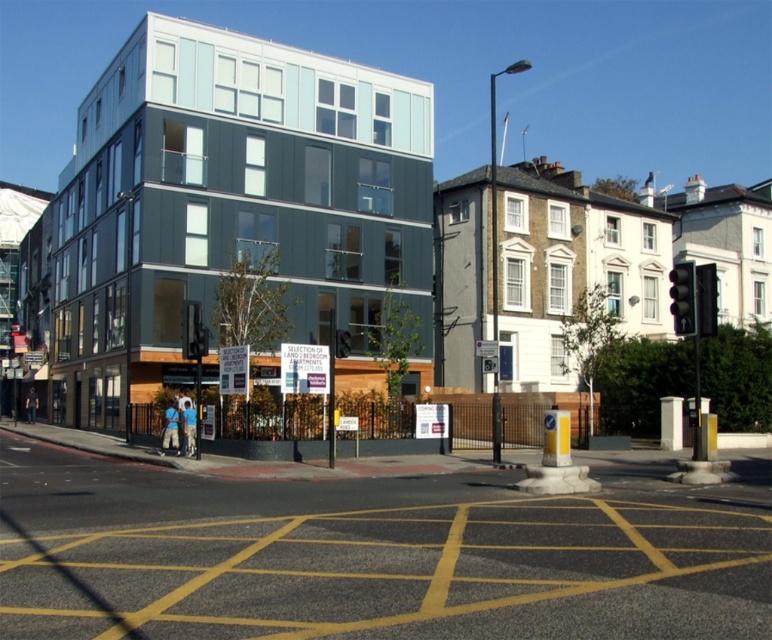
You are standing at the center of the street in the image. Which direction should you walk to reach the metallic traffic light at right?

Since the metallic traffic light at right is located at point [682,298], you should walk towards the right side of the image to reach it.